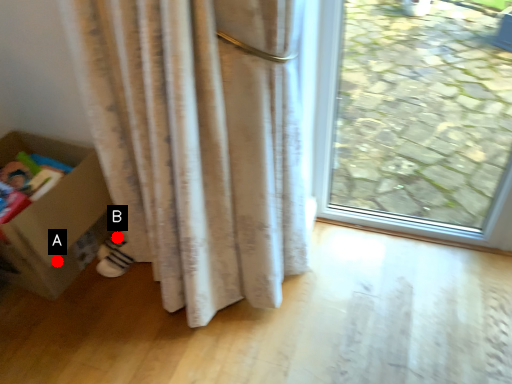
Question: Two points are circled on the image, labeled by A and B beside each circle. Which of the following is the farthest from the observer?

Choices:
 (A) A is further
 (B) B is further

Answer: (B)